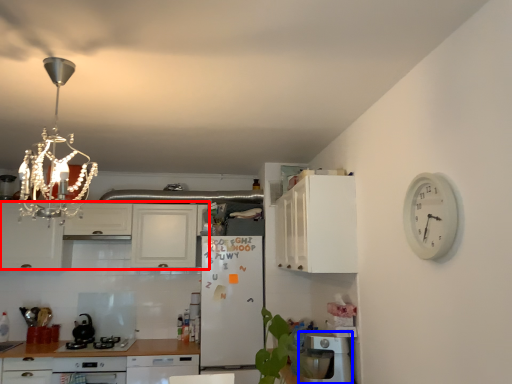
Question: Among these objects, which one is nearest to the camera, cabinetry (highlighted by a red box) or dish washer (highlighted by a blue box)?

Choices:
 (A) cabinetry
 (B) dish washer

Answer: (B)